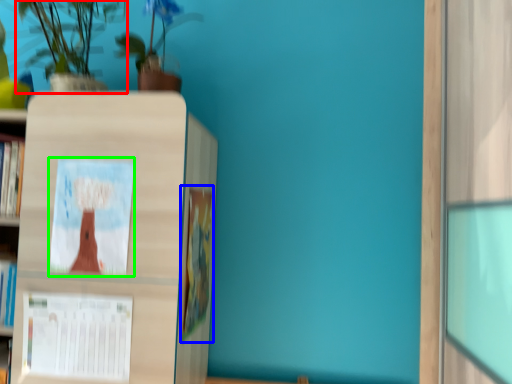
Question: Which is nearer to the houseplant (highlighted by a red box)? book (highlighted by a blue box) or book cover (highlighted by a green box).

Choices:
 (A) book
 (B) book cover

Answer: (B)